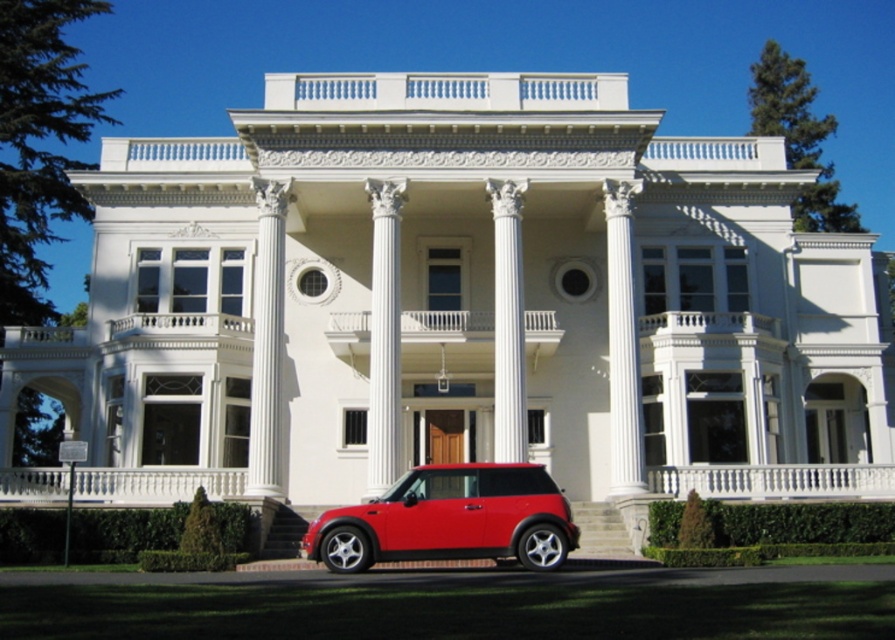
You are standing in front of the mansion and want to park your car to the left of the white marble column at center. Is the glossy red car at lower center currently blocking that spot?

The glossy red car at lower center is to the right of the white marble column at center, so it is not blocking the left side of the column. You can park your car to the left of the white marble column at center without moving the glossy red car at lower center.

You are standing in front of the mansion and want to take a photo. You notice two points marked in the scene. Which point, point (329, 545) or point (521, 310), is closer to your current position?

Point (329, 545) is closer to the camera than point (521, 310), so it is closer to your current position.

You are a delivery person with a package for the mansion. Your vehicle, the glossy red car at lower center, is parked near the white glossy column at center. The mansion requires all deliveries to be made within 10 meters of the entrance. Can you deliver the package without moving your car?

The glossy red car at lower center and white glossy column at center are 11.78 meters apart. Since the mansion requires deliveries to be within 10 meters of the entrance, the car is too far away. You will need to move the car closer to meet the requirement.